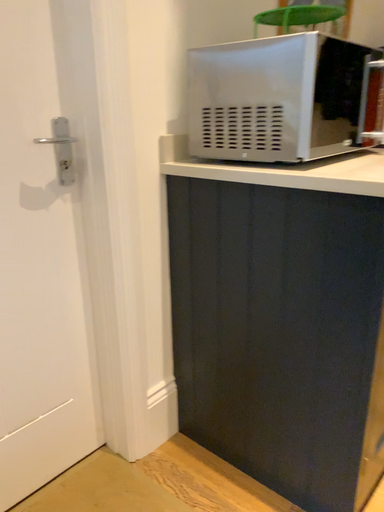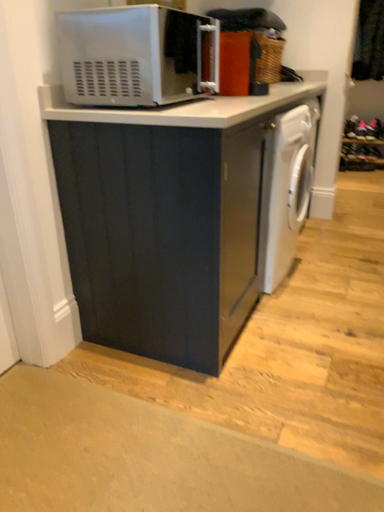
Question: Which way did the camera rotate in the video?

Choices:
 (A) rotated left
 (B) rotated right

Answer: (B)